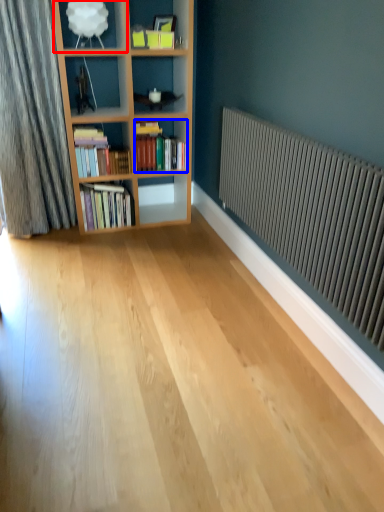
Question: Among these objects, which one is nearest to the camera, shelf (highlighted by a red box) or book (highlighted by a blue box)?

Choices:
 (A) shelf
 (B) book

Answer: (A)